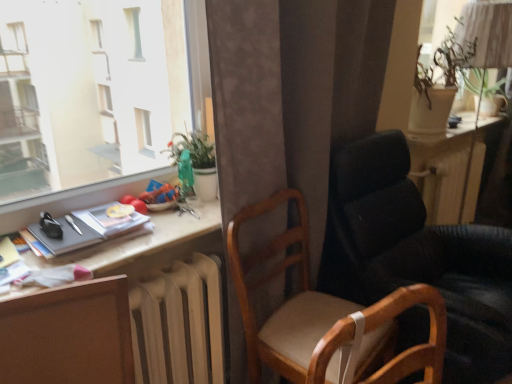
Question: Does white matte radiator at lower center have a lesser height compared to leather-like black chair at right, arranged as the 2th chair when viewed from the left?

Choices:
 (A) yes
 (B) no

Answer: (A)

Question: Considering the relative sizes of white matte radiator at lower center and leather-like black chair at right, arranged as the 2th chair when viewed from the left, in the image provided, is white matte radiator at lower center bigger than leather-like black chair at right, arranged as the 2th chair when viewed from the left,?

Choices:
 (A) yes
 (B) no

Answer: (B)

Question: From the image's perspective, does white matte radiator at lower center appear higher than leather-like black chair at right, arranged as the 2th chair when viewed from the left?

Choices:
 (A) yes
 (B) no

Answer: (B)

Question: Can you confirm if white matte radiator at lower center is wider than leather-like black chair at right, which is the 1th chair from right to left?

Choices:
 (A) no
 (B) yes

Answer: (A)

Question: From a real-world perspective, is white matte radiator at lower center located beneath leather-like black chair at right, arranged as the 2th chair when viewed from the left?

Choices:
 (A) no
 (B) yes

Answer: (B)

Question: In terms of height, does leather-like black chair at right, which is the 1th chair from right to left, look taller or shorter compared to white matte radiator at lower center?

Choices:
 (A) tall
 (B) short

Answer: (A)

Question: From a real-world perspective, is leather-like black chair at right, which is the 1th chair from right to left, above or below white matte radiator at lower center?

Choices:
 (A) above
 (B) below

Answer: (A)

Question: In terms of width, does leather-like black chair at right, which is the 1th chair from right to left, look wider or thinner when compared to white matte radiator at lower center?

Choices:
 (A) wide
 (B) thin

Answer: (A)

Question: Considering their positions, is leather-like black chair at right, arranged as the 2th chair when viewed from the left, located in front of or behind white matte radiator at lower center?

Choices:
 (A) front
 (B) behind

Answer: (A)

Question: Does point (349, 316) appear closer or farther from the camera than point (203, 380)?

Choices:
 (A) farther
 (B) closer

Answer: (B)

Question: Relative to white matte radiator at lower center, is beige fabric swivel chair at center in front or behind?

Choices:
 (A) behind
 (B) front

Answer: (B)

Question: Which is correct: beige fabric swivel chair at center is inside white matte radiator at lower center, or outside of it?

Choices:
 (A) outside
 (B) inside

Answer: (A)

Question: From the image's perspective, relative to white matte radiator at lower center, is beige fabric swivel chair at center above or below?

Choices:
 (A) below
 (B) above

Answer: (B)

Question: In terms of width, does wooden chair at center, which is the first chair in left-to-right order, look wider or thinner when compared to green glossy plant at upper center, which is counted as the second houseplant, starting from the right?

Choices:
 (A) wide
 (B) thin

Answer: (A)

Question: From the image's perspective, is wooden chair at center, which is the first chair in left-to-right order, located above or below green glossy plant at upper center, which is counted as the second houseplant, starting from the right?

Choices:
 (A) below
 (B) above

Answer: (A)